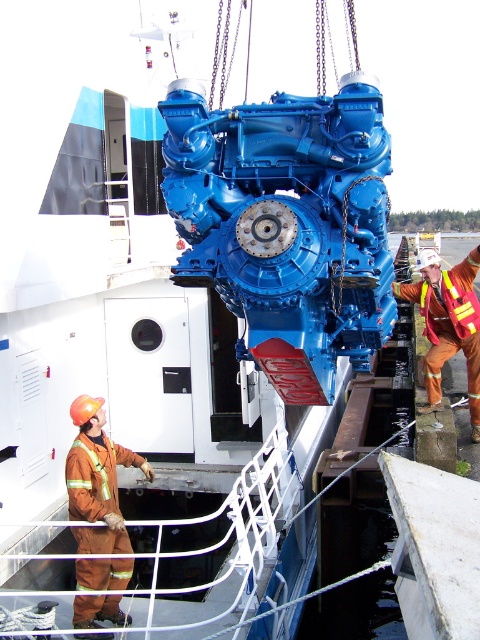
You are a safety inspector standing at the viewer position. You need to check the orange reflective safety vest at center. Can you reach it within 5 meters without moving?

The orange reflective safety vest at center is 4.51 meters away from the viewer, so yes, you can reach it within 5 meters without moving.

You are a safety inspector observing the loading operation of the blue engine onto the ship. You notice two workers wearing protective gear. Based on the image, which worker is wearing the larger protective gear, the one in brown reflective coveralls at lower left or the one in reflective orange safety vest at right?

The brown reflective coveralls at lower left is larger in size than the reflective orange safety vest at right, so the worker in brown reflective coveralls at lower left is wearing the larger protective gear.

You are a safety inspector observing the operation of lifting a heavy engine onto a ship. You notice two workers wearing protective gear. One is in brown reflective coveralls at lower left and the other in orange reflective safety vest at center. Which worker is positioned more to the left side of the scene?

The brown reflective coveralls at lower left is positioned on the left side of orange reflective safety vest at center, so the worker in brown reflective coveralls at lower left is more to the left.